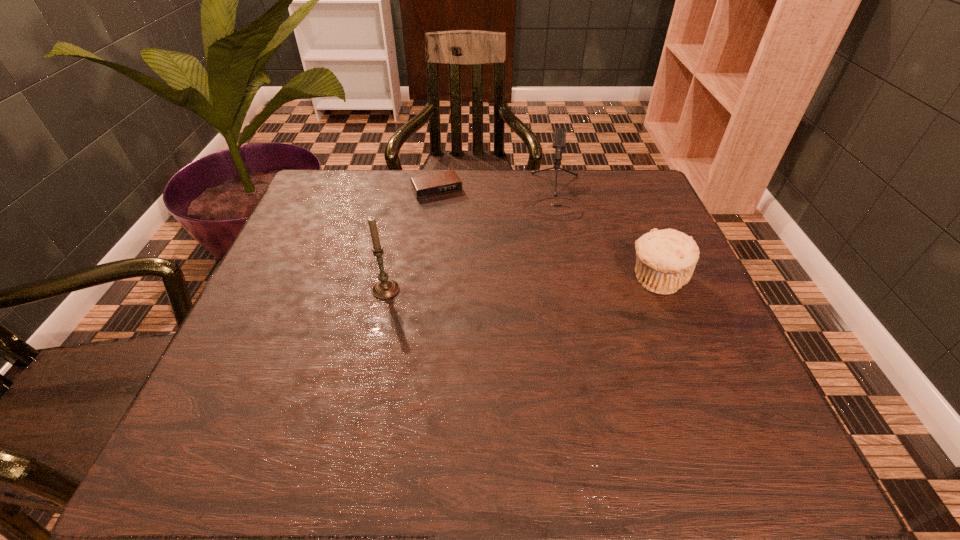
In order to click on vacant space on the desktop that is between the candle and the muffin and is positioned on the front face of the alarm clock in this screenshot , I will do `click(489, 286)`.

Find the location of a particular element. The width and height of the screenshot is (960, 540). vacant space on the desktop that is between the candle and the second shortest object and is positioned on the stand of the microphone is located at coordinates (556, 284).